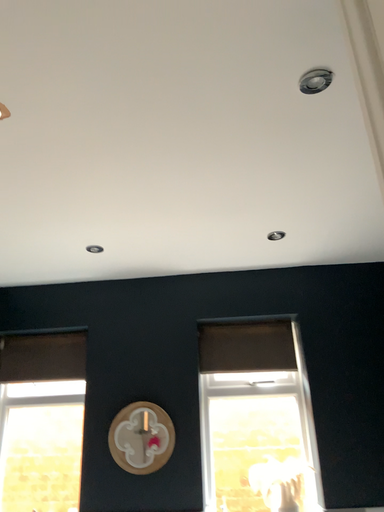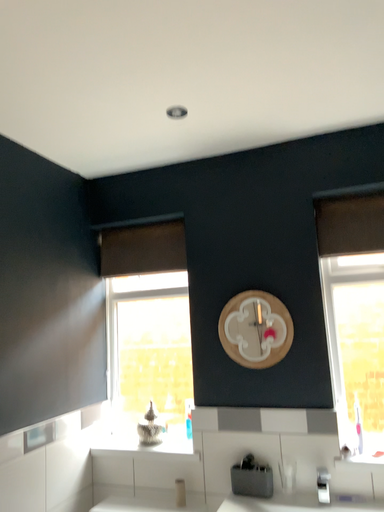
Question: How did the camera likely rotate when shooting the video?

Choices:
 (A) rotated left
 (B) rotated right

Answer: (A)